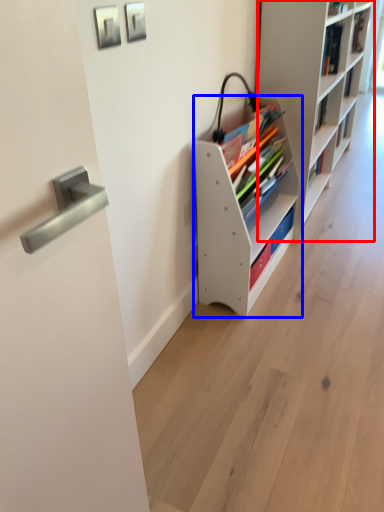
Question: Which object is further to the camera taking this photo, shelf (highlighted by a red box) or shelf (highlighted by a blue box)?

Choices:
 (A) shelf
 (B) shelf

Answer: (A)